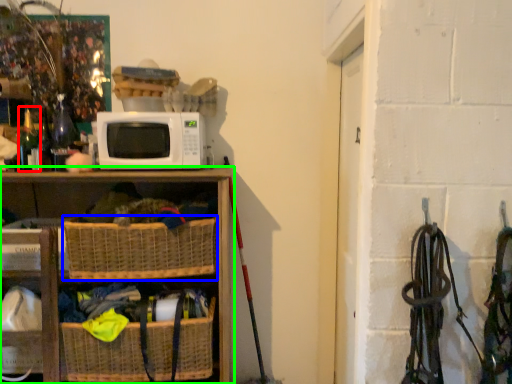
Question: Estimate the real-world distances between objects in this image. Which object is closer to bottle (highlighted by a red box), basket (highlighted by a blue box) or shelf (highlighted by a green box)?

Choices:
 (A) basket
 (B) shelf

Answer: (B)